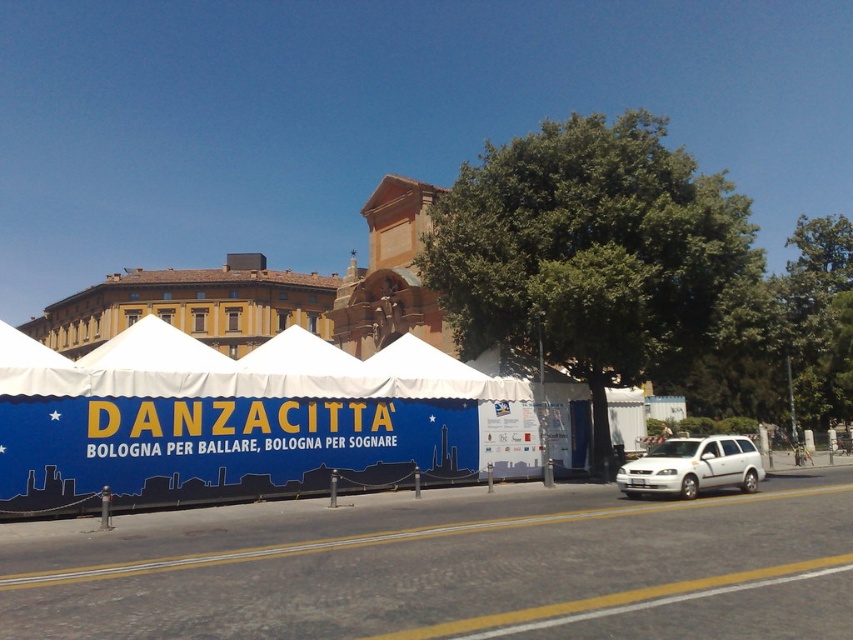
You are a photographer planning to take a photo of the blue fabric tent at center and the white matte van at lower right. Since you want both objects to appear equally prominent in the photo, which one should you zoom in on more?

The blue fabric tent at center is larger in size than the white matte van at lower right, so you should zoom in more on the white matte van at lower right to balance their prominence in the photo.

You are planning to set up a food stall at the event. The city requires all stalls to be placed within 10 meters of the blue fabric tent at center for safety. If you want to place your stall at point A, which is at coordinates 0.655, 0.268, will it comply with the safety regulations?

The blue fabric tent at center is located at point (228,419), so placing your stall at that exact coordinate would be exactly at the tent, which is within the 10 meters requirement. Therefore, it complies with the safety regulations.

You are a photographer wanting to capture both the blue fabric tent at center and the white matte van at lower right in the same frame. Based on their positions, will you need to adjust your camera angle to include both?

The blue fabric tent at center is in front of the white matte van at lower right, so you will need to adjust your camera angle to include both in the same frame since they are positioned at different depths.